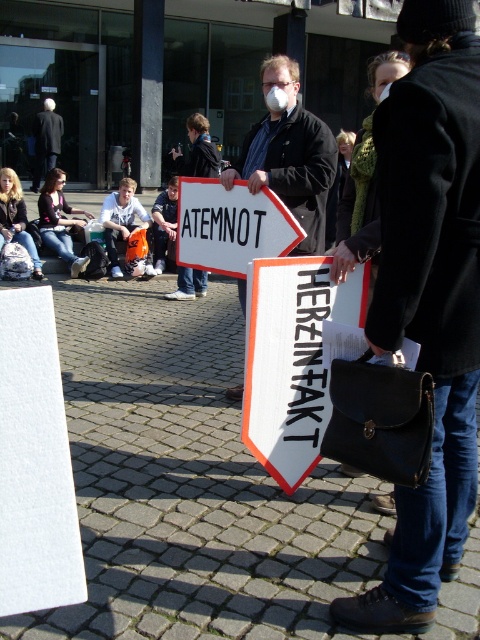
Does matte black jacket at center have a larger size compared to white cotton shirt at center?

No.

From the picture: Who is more forward, (x=311, y=218) or (x=112, y=211)?

Point (x=311, y=218) is more forward.

Where is `matte black jacket at center`? This screenshot has width=480, height=640. matte black jacket at center is located at coordinates (288, 154).

Who is shorter, white matte sign at center or white plastic sign at center?

white plastic sign at center is shorter.

Is point (299, 413) positioned behind point (183, 253)?

No.

I want to click on white matte sign at center, so click(x=291, y=358).

Can you confirm if white matte sign at center is smaller than matte black jacket at center?

Correct, white matte sign at center occupies less space than matte black jacket at center.

Is white matte sign at center above matte black jacket at center?

No.

Which is in front, point (317, 378) or point (317, 193)?

Point (317, 378) is more forward.

Find the location of a particular element. This screenshot has width=480, height=640. white matte sign at center is located at coordinates (291, 358).